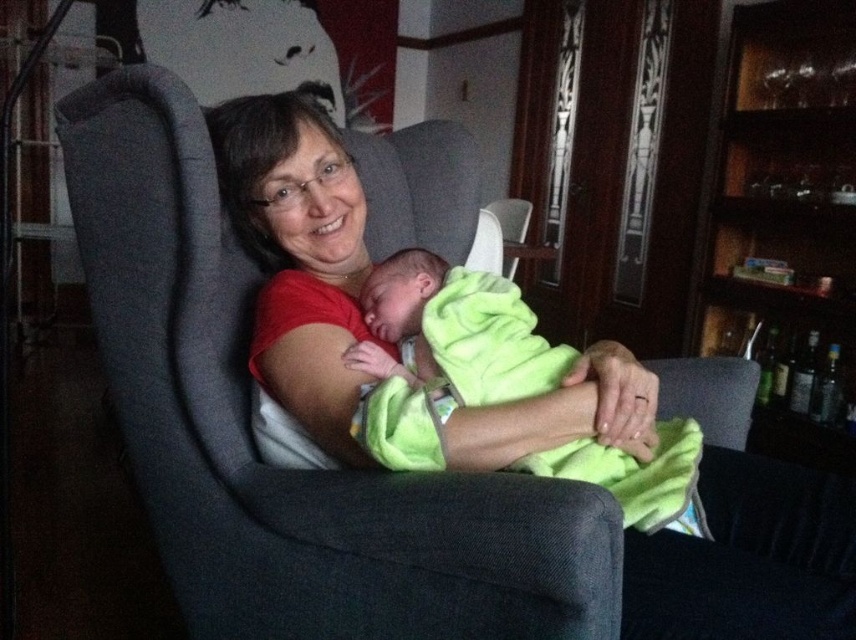
Who is positioned more to the right, matte red shirt at center or soft green blanket at center?

Positioned to the right is matte red shirt at center.

The image size is (856, 640). Identify the location of matte red shirt at center. (299, 256).

Find the location of `matte red shirt at center`. matte red shirt at center is located at coordinates (299, 256).